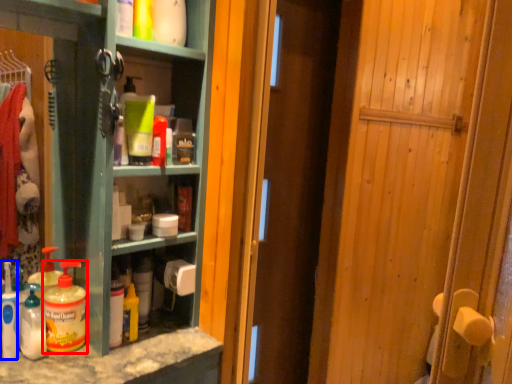
Question: Which object is further to the camera taking this photo, bottle (highlighted by a red box) or cleaning product (highlighted by a blue box)?

Choices:
 (A) bottle
 (B) cleaning product

Answer: (A)